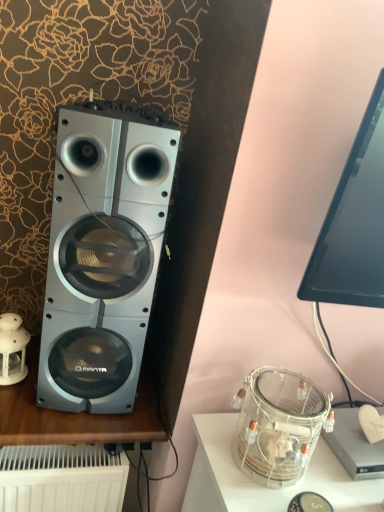
The image size is (384, 512). I want to click on clear glass jar at lower right, so click(x=278, y=426).

Image resolution: width=384 pixels, height=512 pixels. Describe the element at coordinates (262, 486) in the screenshot. I see `clear glass jar at lower right` at that location.

Locate an element on the screen. The image size is (384, 512). white porcelain lantern at left is located at coordinates (12, 349).

The image size is (384, 512). Describe the element at coordinates (12, 349) in the screenshot. I see `white porcelain lantern at left` at that location.

Where is `black glossy monitor at upper right`? The height and width of the screenshot is (512, 384). black glossy monitor at upper right is located at coordinates (354, 223).

The width and height of the screenshot is (384, 512). In order to click on clear glass jar at lower right in this screenshot , I will do `click(278, 426)`.

This screenshot has height=512, width=384. In order to click on furniture that is on the right side of white porcelain lantern at left in this screenshot , I will do `click(262, 486)`.

Consider the image. Which is in front, white porcelain lantern at left or clear glass jar at lower right?

clear glass jar at lower right is in front.

Between point (8, 362) and point (232, 490), which one is positioned behind?

Point (8, 362)

This screenshot has width=384, height=512. I want to click on appliance below the white porcelain lantern at left (from the image's perspective), so (x=278, y=426).

Which of these two, clear glass jar at lower right or white porcelain lantern at left, is thinner?

white porcelain lantern at left.

From a real-world perspective, is clear glass jar at lower right beneath white porcelain lantern at left?

Incorrect, from a real-world perspective, clear glass jar at lower right is higher than white porcelain lantern at left.

Is clear glass jar at lower right next to white porcelain lantern at left and touching it?

No, clear glass jar at lower right is not next to white porcelain lantern at left.

Considering the positions of objects white porcelain lantern at left and black glossy monitor at upper right in the image provided, who is more to the right, white porcelain lantern at left or black glossy monitor at upper right?

black glossy monitor at upper right.

Is white porcelain lantern at left turned away from black glossy monitor at upper right?

No, white porcelain lantern at left is not facing the opposite direction of black glossy monitor at upper right.

In terms of width, does white porcelain lantern at left look wider or thinner when compared to black glossy monitor at upper right?

white porcelain lantern at left is thinner than black glossy monitor at upper right.

Does point (213, 474) lie in front of point (237, 437)?

Yes.

Is clear glass jar at lower right touching clear glass jar at lower right?

clear glass jar at lower right and clear glass jar at lower right are clearly separated.

Who is more distant, clear glass jar at lower right or clear glass jar at lower right?

clear glass jar at lower right is behind.

Is clear glass jar at lower right thinner than clear glass jar at lower right?

Incorrect, the width of clear glass jar at lower right is not less than that of clear glass jar at lower right.

From the image's perspective, relative to black glossy monitor at upper right, is clear glass jar at lower right above or below?

clear glass jar at lower right is situated lower than black glossy monitor at upper right in the image.

Could you tell me if clear glass jar at lower right is turned towards black glossy monitor at upper right?

No, clear glass jar at lower right does not turn towards black glossy monitor at upper right.

Is clear glass jar at lower right inside the boundaries of black glossy monitor at upper right, or outside?

clear glass jar at lower right exists outside the volume of black glossy monitor at upper right.

Is clear glass jar at lower right positioned far away from black glossy monitor at upper right?

No.

From a real-world perspective, is silver metallic speaker at left below clear glass jar at lower right?

No.

Is silver metallic speaker at left completely or partially outside of clear glass jar at lower right?

Yes, silver metallic speaker at left is not within clear glass jar at lower right.

Does point (135, 185) come closer to viewer compared to point (256, 481)?

No.

Can you confirm if silver metallic speaker at left is thinner than clear glass jar at lower right?

No, silver metallic speaker at left is not thinner than clear glass jar at lower right.

Can you confirm if silver metallic speaker at left is thinner than clear glass jar at lower right?

No.

Is silver metallic speaker at left facing away from clear glass jar at lower right?

silver metallic speaker at left is not turned away from clear glass jar at lower right.

What's the angular difference between silver metallic speaker at left and clear glass jar at lower right's facing directions?

The angular difference between silver metallic speaker at left and clear glass jar at lower right is 10.1 degrees.

Is silver metallic speaker at left beside clear glass jar at lower right?

They are not placed beside each other.

Image resolution: width=384 pixels, height=512 pixels. Find the location of `furniture located in front of the white porcelain lantern at left`. furniture located in front of the white porcelain lantern at left is located at coordinates tap(262, 486).

Where is `appliance that is above the white porcelain lantern at left (from a real-world perspective)`? appliance that is above the white porcelain lantern at left (from a real-world perspective) is located at coordinates (278, 426).

Based on the photo, estimate the real-world distances between objects in this image. Which object is closer to silver metallic speaker at left, white porcelain lantern at left or clear glass jar at lower right?

white porcelain lantern at left is positioned closer to the anchor silver metallic speaker at left.

When comparing their distances from clear glass jar at lower right, does black glossy monitor at upper right or white porcelain lantern at left seem further?

white porcelain lantern at left.

When comparing their distances from clear glass jar at lower right, does silver metallic speaker at left or white porcelain lantern at left seem further?

white porcelain lantern at left is further to clear glass jar at lower right.

Estimate the real-world distances between objects in this image. Which object is further from clear glass jar at lower right, white porcelain lantern at left or black glossy monitor at upper right?

The object further to clear glass jar at lower right is white porcelain lantern at left.

Looking at the image, which one is located closer to clear glass jar at lower right, black glossy monitor at upper right or silver metallic speaker at left?

black glossy monitor at upper right is closer to clear glass jar at lower right.

Considering their positions, is clear glass jar at lower right positioned further to black glossy monitor at upper right than clear glass jar at lower right?

Based on the image, clear glass jar at lower right appears to be further to black glossy monitor at upper right.

Looking at the image, which one is located closer to silver metallic speaker at left, black glossy monitor at upper right or white porcelain lantern at left?

Among the two, white porcelain lantern at left is located nearer to silver metallic speaker at left.

Looking at this image, based on their spatial positions, is clear glass jar at lower right or white porcelain lantern at left further from silver metallic speaker at left?

clear glass jar at lower right is positioned further to the anchor silver metallic speaker at left.

Where is `appliance between silver metallic speaker at left and clear glass jar at lower right in the vertical direction`? appliance between silver metallic speaker at left and clear glass jar at lower right in the vertical direction is located at coordinates (278, 426).

You are a GUI agent. You are given a task and a screenshot of the screen. Output one action in this format:
    pyautogui.click(x=<x>, y=<y>)
    Task: Click on the home appliance between white porcelain lantern at left and clear glass jar at lower right
    
    Given the screenshot: What is the action you would take?
    pyautogui.click(x=103, y=253)

Find the location of `appliance between black glossy monitor at upper right and clear glass jar at lower right from top to bottom`. appliance between black glossy monitor at upper right and clear glass jar at lower right from top to bottom is located at coordinates (278, 426).

This screenshot has height=512, width=384. In order to click on home appliance between black glossy monitor at upper right and clear glass jar at lower right in the vertical direction in this screenshot , I will do `click(103, 253)`.